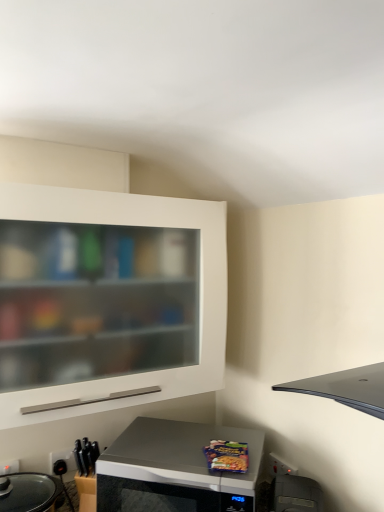
What do you see at coordinates (296, 494) in the screenshot? The image size is (384, 512). I see `black plastic toaster at lower right` at bounding box center [296, 494].

Where is `black plastic toaster at lower right`? This screenshot has width=384, height=512. black plastic toaster at lower right is located at coordinates (296, 494).

From the picture: Is white matte cabinet at upper left not near silver metallic microwave at lower center?

No, white matte cabinet at upper left is not far from silver metallic microwave at lower center.

Could you tell me if white matte cabinet at upper left is turned towards silver metallic microwave at lower center?

No, white matte cabinet at upper left does not turn towards silver metallic microwave at lower center.

Which is in front, white matte cabinet at upper left or silver metallic microwave at lower center?

white matte cabinet at upper left is in front.

Does white matte cabinet at upper left appear on the left side of silver metallic microwave at lower center?

Yes, white matte cabinet at upper left is to the left of silver metallic microwave at lower center.

From the image's perspective, is black plastic electric outlet at lower left located above black plastic toaster at lower right?

Incorrect, from the image's perspective, black plastic electric outlet at lower left is lower than black plastic toaster at lower right.

Relative to black plastic toaster at lower right, is black plastic electric outlet at lower left in front or behind?

black plastic electric outlet at lower left is positioned farther from the viewer than black plastic toaster at lower right.

Locate an element on the screen. The height and width of the screenshot is (512, 384). appliance lying on the right of black plastic electric outlet at lower left is located at coordinates (296, 494).

From the image's perspective, which is below, silver metallic microwave at lower center or black plastic toaster at lower right?

silver metallic microwave at lower center appears lower in the image.

Would you say silver metallic microwave at lower center contains black plastic toaster at lower right?

No, black plastic toaster at lower right is not a part of silver metallic microwave at lower center.

From a real-world perspective, is silver metallic microwave at lower center positioned over black plastic toaster at lower right based on gravity?

No, from a real-world perspective, silver metallic microwave at lower center is not over black plastic toaster at lower right

Who is shorter, black plastic electric outlet at lower left or white matte cabinet at upper left?

black plastic electric outlet at lower left is shorter.

Which of these two, black plastic electric outlet at lower left or white matte cabinet at upper left, is thinner?

With smaller width is black plastic electric outlet at lower left.

Measure the distance between black plastic electric outlet at lower left and white matte cabinet at upper left.

black plastic electric outlet at lower left is 27.48 inches from white matte cabinet at upper left.

Can you confirm if black plastic electric outlet at lower left is positioned to the right of white matte cabinet at upper left?

Incorrect, black plastic electric outlet at lower left is not on the right side of white matte cabinet at upper left.

Could you tell me if black plastic toaster at lower right is facing black plastic electric outlet at lower left?

No.

Is black plastic toaster at lower right positioned beyond the bounds of black plastic electric outlet at lower left?

black plastic toaster at lower right lies outside black plastic electric outlet at lower left's area.

Considering the relative positions of black plastic toaster at lower right and black plastic electric outlet at lower left in the image provided, is black plastic toaster at lower right behind black plastic electric outlet at lower left?

No.

Which is in front, point (298, 489) or point (55, 471)?

The point (298, 489) is more forward.

Is black plastic electric outlet at lower left touching silver metallic microwave at lower center?

No, black plastic electric outlet at lower left is not beside silver metallic microwave at lower center.

From the image's perspective, which one is positioned higher, black plastic electric outlet at lower left or silver metallic microwave at lower center?

From the image's view, black plastic electric outlet at lower left is above.

Can you confirm if black plastic electric outlet at lower left is positioned to the left of silver metallic microwave at lower center?

Yes.

This screenshot has height=512, width=384. Find the location of `electric outlet lying behind the silver metallic microwave at lower center`. electric outlet lying behind the silver metallic microwave at lower center is located at coordinates (62, 461).

Which is in front, point (183, 204) or point (52, 469)?

The point (183, 204) is in front.

Considering the relative sizes of white matte cabinet at upper left and black plastic electric outlet at lower left in the image provided, is white matte cabinet at upper left thinner than black plastic electric outlet at lower left?

Incorrect, the width of white matte cabinet at upper left is not less than that of black plastic electric outlet at lower left.

Can you confirm if white matte cabinet at upper left is bigger than black plastic electric outlet at lower left?

Yes.

Between white matte cabinet at upper left and black plastic electric outlet at lower left, which one has more height?

With more height is white matte cabinet at upper left.

This screenshot has height=512, width=384. Identify the location of cabinetry in front of the silver metallic microwave at lower center. (138, 225).

I want to click on electric outlet on the left of black plastic toaster at lower right, so click(x=62, y=461).

Considering their positions, is silver metallic microwave at lower center positioned further to black plastic toaster at lower right than black plastic electric outlet at lower left?

black plastic electric outlet at lower left is positioned further to the anchor black plastic toaster at lower right.

When comparing their distances from white matte cabinet at upper left, does silver metallic microwave at lower center or black plastic toaster at lower right seem closer?

Based on the image, silver metallic microwave at lower center appears to be nearer to white matte cabinet at upper left.

When comparing their distances from silver metallic microwave at lower center, does white matte cabinet at upper left or black plastic electric outlet at lower left seem closer?

Based on the image, white matte cabinet at upper left appears to be nearer to silver metallic microwave at lower center.

From the image, which object appears to be farther from black plastic toaster at lower right, white matte cabinet at upper left or silver metallic microwave at lower center?

white matte cabinet at upper left is positioned further to the anchor black plastic toaster at lower right.

Looking at the image, which one is located closer to black plastic toaster at lower right, white matte cabinet at upper left or black plastic electric outlet at lower left?

white matte cabinet at upper left lies closer to black plastic toaster at lower right than the other object.

Which object lies nearer to the anchor point black plastic electric outlet at lower left, white matte cabinet at upper left or silver metallic microwave at lower center?

silver metallic microwave at lower center.

Consider the image. Based on their spatial positions, is black plastic electric outlet at lower left or black plastic toaster at lower right further from white matte cabinet at upper left?

Based on the image, black plastic electric outlet at lower left appears to be further to white matte cabinet at upper left.

Considering their positions, is black plastic toaster at lower right positioned closer to white matte cabinet at upper left than silver metallic microwave at lower center?

silver metallic microwave at lower center is closer to white matte cabinet at upper left.

This screenshot has width=384, height=512. I want to click on microwave oven located between black plastic electric outlet at lower left and black plastic toaster at lower right in the left-right direction, so click(x=174, y=469).

Where is `cabinetry between black plastic electric outlet at lower left and black plastic toaster at lower right in the horizontal direction`? This screenshot has width=384, height=512. cabinetry between black plastic electric outlet at lower left and black plastic toaster at lower right in the horizontal direction is located at coordinates (138, 225).

Image resolution: width=384 pixels, height=512 pixels. Identify the location of electric outlet that lies between white matte cabinet at upper left and silver metallic microwave at lower center from top to bottom. (62, 461).

Locate an element on the screen. This screenshot has width=384, height=512. appliance between white matte cabinet at upper left and silver metallic microwave at lower center in the up-down direction is located at coordinates (296, 494).